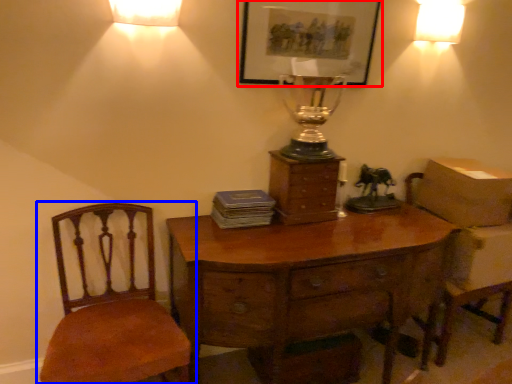
Question: Which of the following is the closest to the observer, picture frame (highlighted by a red box) or chair (highlighted by a blue box)?

Choices:
 (A) picture frame
 (B) chair

Answer: (B)